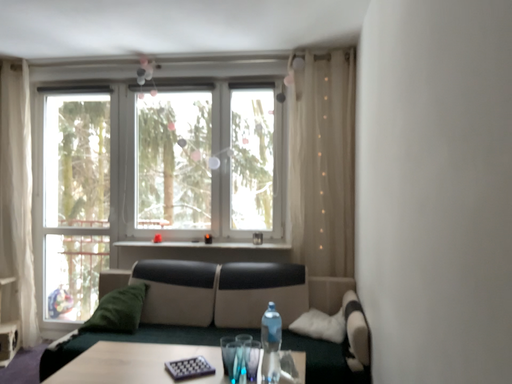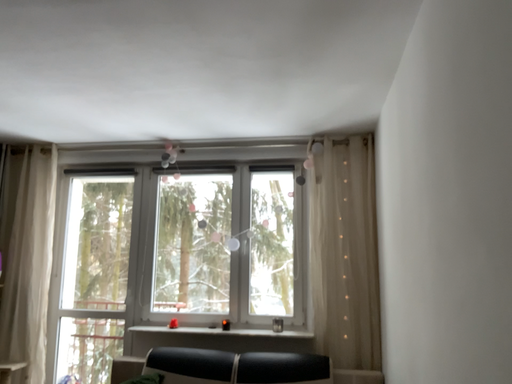
Question: Which way did the camera rotate in the video?

Choices:
 (A) rotated downward
 (B) rotated upward

Answer: (B)